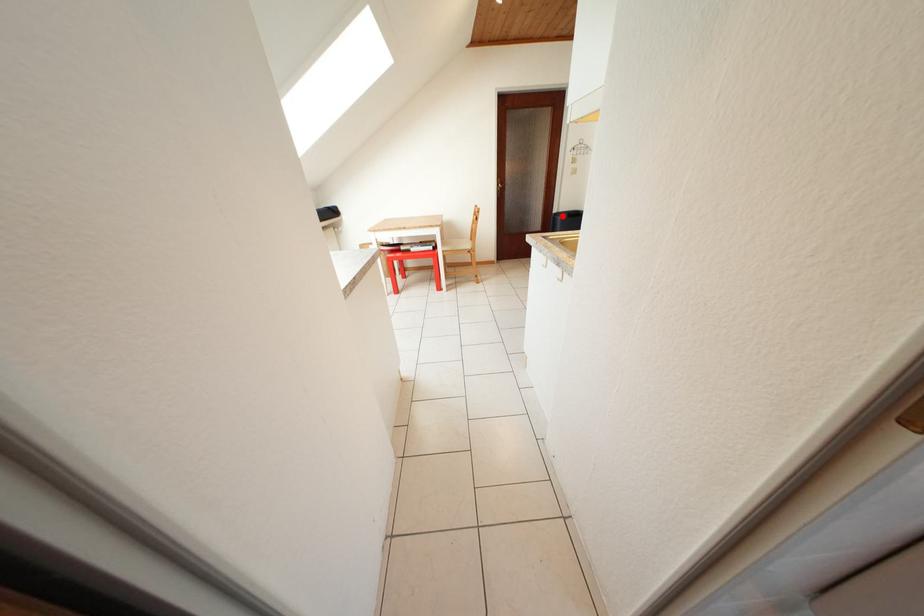
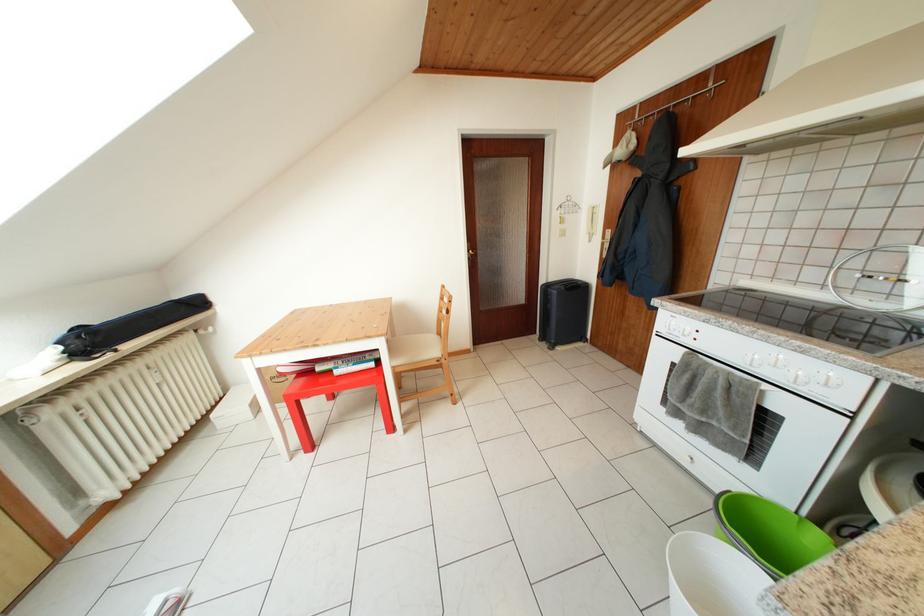
Question: I am providing you with two images of the same scene from different viewpoints. Image1 has a red point marked. In image2, the corresponding 3D location appears at what relative position? Reply with the corresponding letter.

Choices:
 (A) Closer
 (B) Farther

Answer: (A)